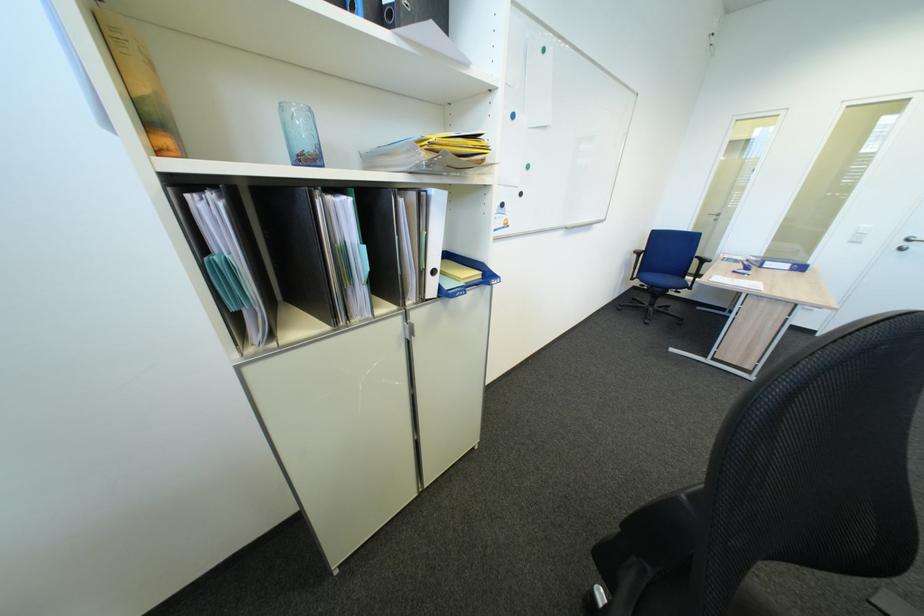
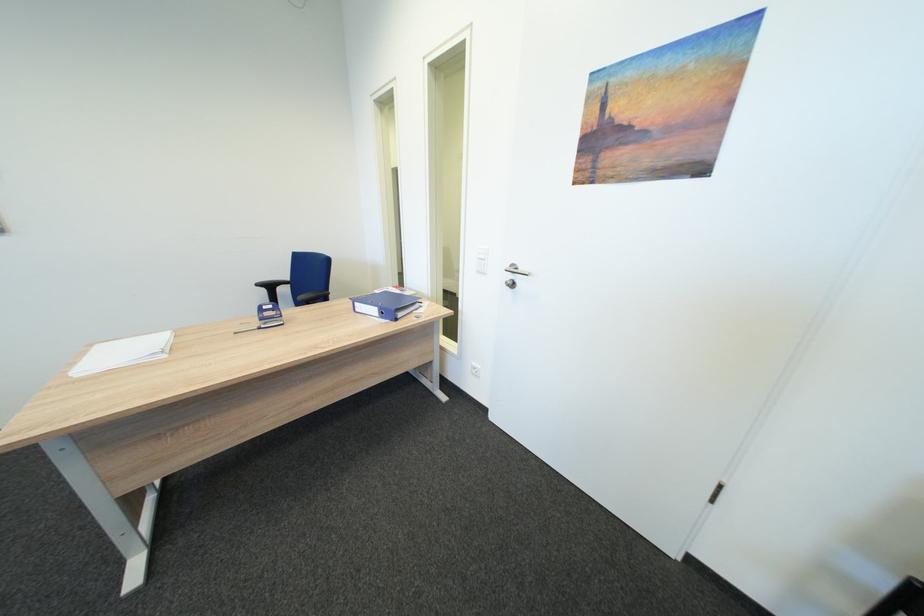
Question: In a continuous first-person perspective shot, in which direction is the camera moving?

Choices:
 (A) Left
 (B) Right
 (C) Forward
 (D) Backward

Answer: (B)